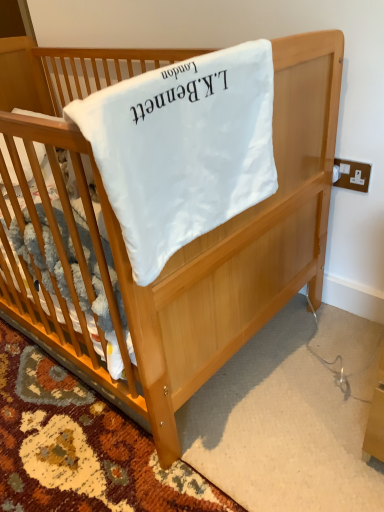
This screenshot has width=384, height=512. Find the location of `white soft blanket at center`. white soft blanket at center is located at coordinates (183, 148).

Image resolution: width=384 pixels, height=512 pixels. What do you see at coordinates (183, 148) in the screenshot?
I see `white soft blanket at center` at bounding box center [183, 148].

At what (x,y) coordinates should I click in order to perform the action: click on white soft blanket at center. Please return your answer as a coordinate pair (x, y). This screenshot has width=384, height=512. Looking at the image, I should click on (183, 148).